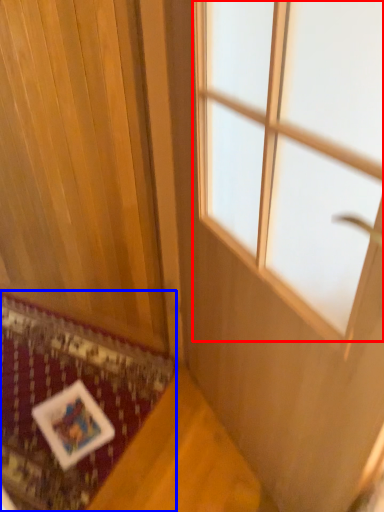
Question: Which point is closer to the camera, window (highlighted by a red box) or mat (highlighted by a blue box)?

Choices:
 (A) window
 (B) mat

Answer: (A)